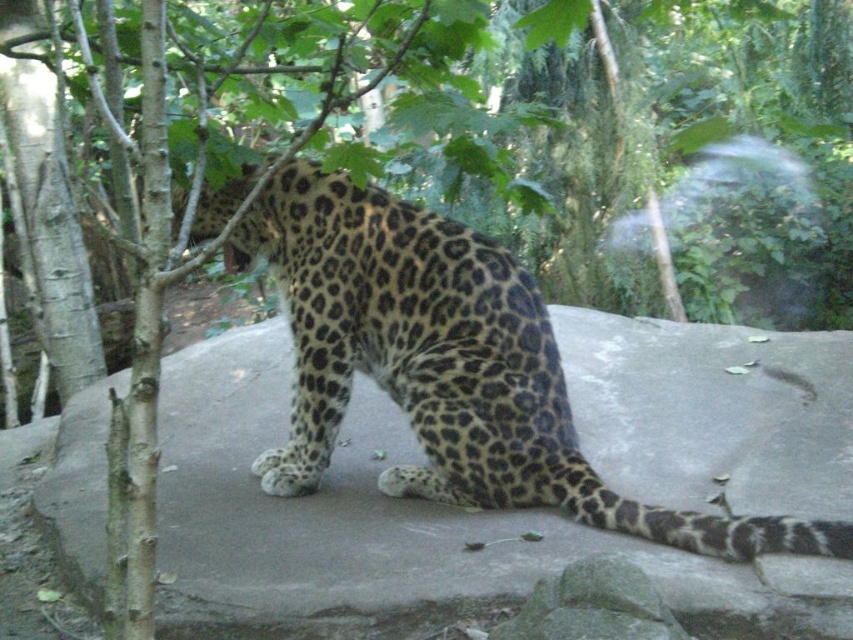
Can you confirm if gray concrete boulder at center is positioned above spotted fur leopard at center?

Actually, gray concrete boulder at center is below spotted fur leopard at center.

Does gray concrete boulder at center appear on the right side of spotted fur leopard at center?

No, gray concrete boulder at center is not to the right of spotted fur leopard at center.

Which is in front, point (761, 442) or point (341, 364)?

Point (341, 364)

At what (x,y) coordinates should I click in order to perform the action: click on gray concrete boulder at center. Please return your answer as a coordinate pair (x, y). Looking at the image, I should click on (390, 529).